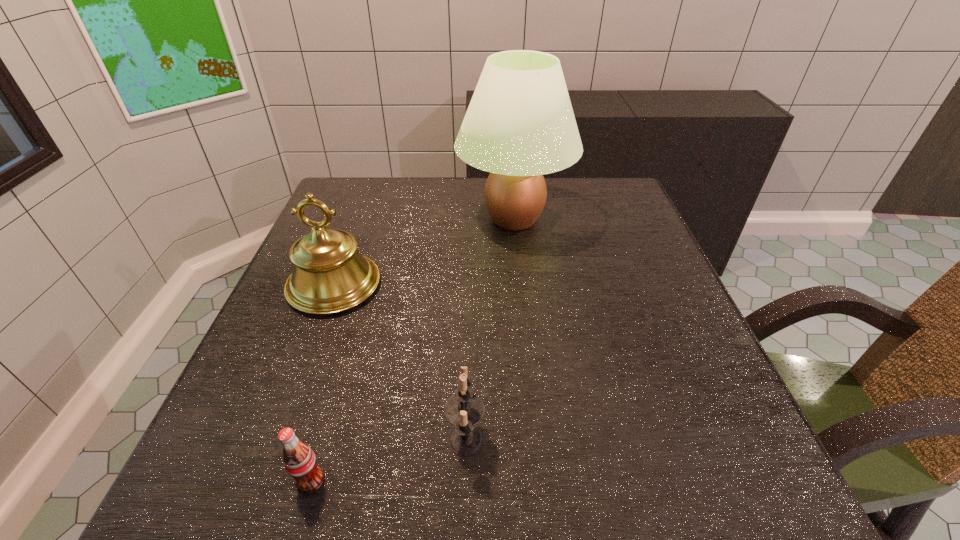
Locate an element on the screen. vacant area between the shortest object and the candle holder is located at coordinates (388, 460).

Locate an element on the screen. Image resolution: width=960 pixels, height=540 pixels. vacant area that lies between the candle holder and the soda is located at coordinates click(388, 460).

Where is `free space between the second shortest object and the soda`? Image resolution: width=960 pixels, height=540 pixels. free space between the second shortest object and the soda is located at coordinates (388, 460).

The width and height of the screenshot is (960, 540). I want to click on unoccupied area between the second shortest object and the bell, so click(399, 362).

Where is `unoccupied area between the farthest object and the candle holder`? unoccupied area between the farthest object and the candle holder is located at coordinates (490, 329).

In order to click on free spot between the soda and the farthest object in this screenshot , I will do `click(412, 350)`.

Locate an element on the screen. The image size is (960, 540). object that is the third nearest to the tallest object is located at coordinates (299, 460).

Locate an element on the screen. Image resolution: width=960 pixels, height=540 pixels. object that can be found as the closest to the second shortest object is located at coordinates (299, 460).

Find the location of a particular element. The image size is (960, 540). free location that satisfies the following two spatial constraints: 1. on the shade of the farthest object; 2. on the front side of the shortest object is located at coordinates (541, 481).

Identify the location of vacant area in the image that satisfies the following two spatial constraints: 1. on the back side of the third tallest object; 2. on the right side of the soda. (324, 438).